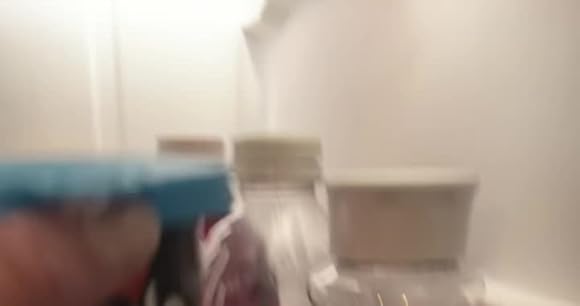
Locate an element on the screen. This screenshot has height=306, width=580. tupperware cap is located at coordinates (191, 199).